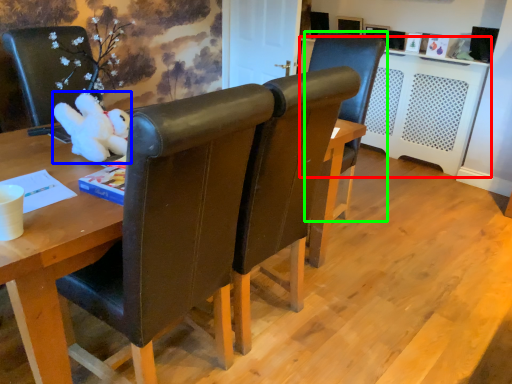
Question: Which object is the farthest from computer desk (highlighted by a red box)? Choose among these: toy (highlighted by a blue box) or chair (highlighted by a green box).

Choices:
 (A) toy
 (B) chair

Answer: (A)